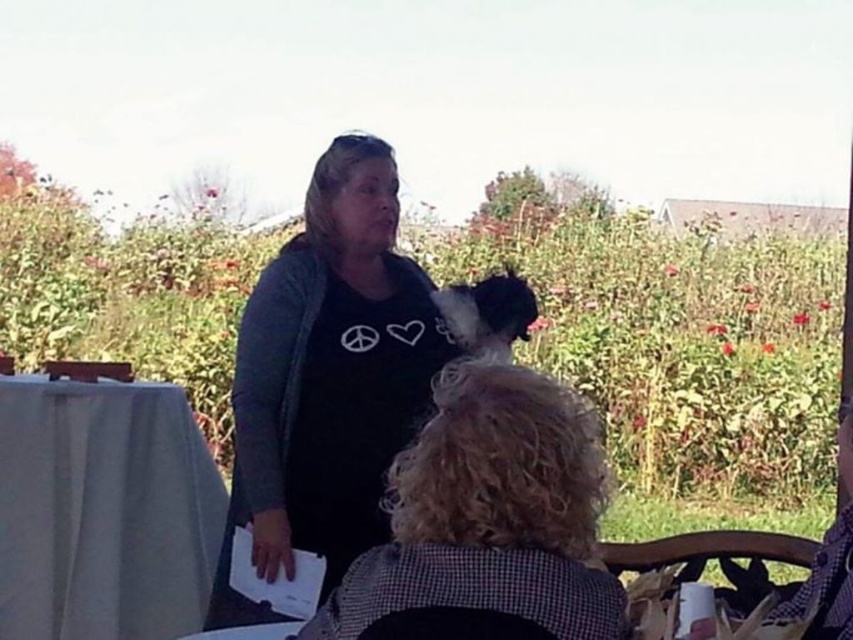
Question: Among these objects, which one is nearest to the camera?

Choices:
 (A) black fur dog at center
 (B) black cotton shirt at center

Answer: (B)

Question: Which object is farther from the camera taking this photo?

Choices:
 (A) black matte shirt at center
 (B) black cotton shirt at center

Answer: (A)

Question: From the image, what is the correct spatial relationship of black matte shirt at center in relation to black fur dog at center?

Choices:
 (A) left
 (B) right

Answer: (A)

Question: Which object is positioned farthest from the black matte shirt at center?

Choices:
 (A) black fur dog at center
 (B) black cotton shirt at center
 (C) white cloth at left

Answer: (B)

Question: Is black matte shirt at center closer to the viewer compared to black fur dog at center?

Choices:
 (A) no
 (B) yes

Answer: (A)

Question: Is black cotton shirt at center bigger than black fur dog at center?

Choices:
 (A) yes
 (B) no

Answer: (A)